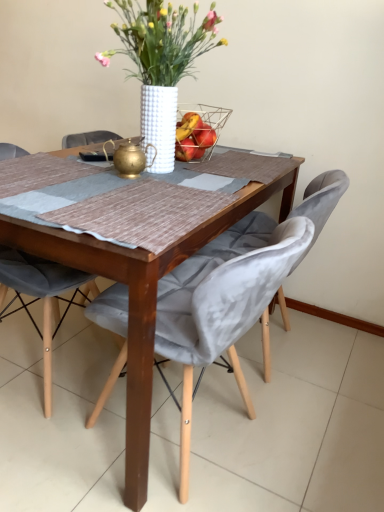
Where is `free space in front of wire mesh basket at center`? The image size is (384, 512). free space in front of wire mesh basket at center is located at coordinates (202, 172).